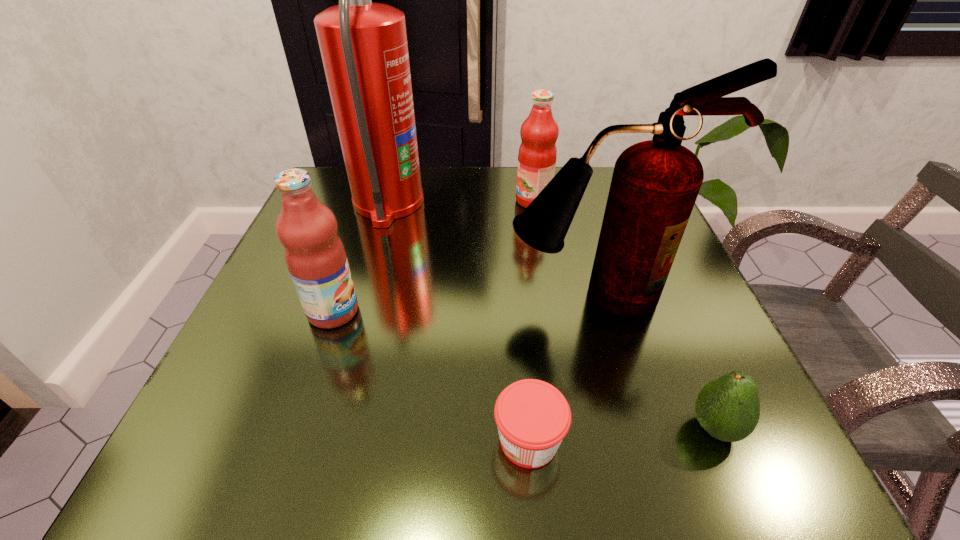
Identify the location of blank space located 0.060m on the front label of the nearer fruit juice. (395, 312).

Locate an element on the screen. vacant position located 0.060m on the front label of the farther fruit juice is located at coordinates (489, 201).

Find the location of `vacant area located on the front label of the farther fruit juice`. vacant area located on the front label of the farther fruit juice is located at coordinates (423, 201).

Where is `free space located on the front label of the farther fruit juice`? The image size is (960, 540). free space located on the front label of the farther fruit juice is located at coordinates (485, 201).

This screenshot has height=540, width=960. Find the location of `free point located on the left of the second shortest object`. free point located on the left of the second shortest object is located at coordinates (500, 428).

Where is `vacant space located on the label side of the jam`? vacant space located on the label side of the jam is located at coordinates (416, 441).

This screenshot has height=540, width=960. Find the location of `vacant space positioned on the label side of the jam`. vacant space positioned on the label side of the jam is located at coordinates (354, 441).

You are a GUI agent. You are given a task and a screenshot of the screen. Output one action in this format:
    pyautogui.click(x=<x>, y=<y>)
    Task: Click on the vacant space positioned on the label side of the jam
    The height and width of the screenshot is (540, 960).
    Given the screenshot: What is the action you would take?
    pyautogui.click(x=224, y=441)

This screenshot has height=540, width=960. I want to click on fire extinguisher located at the far edge, so click(363, 45).

Where is `fruit juice at the far edge`? The width and height of the screenshot is (960, 540). fruit juice at the far edge is located at coordinates (537, 155).